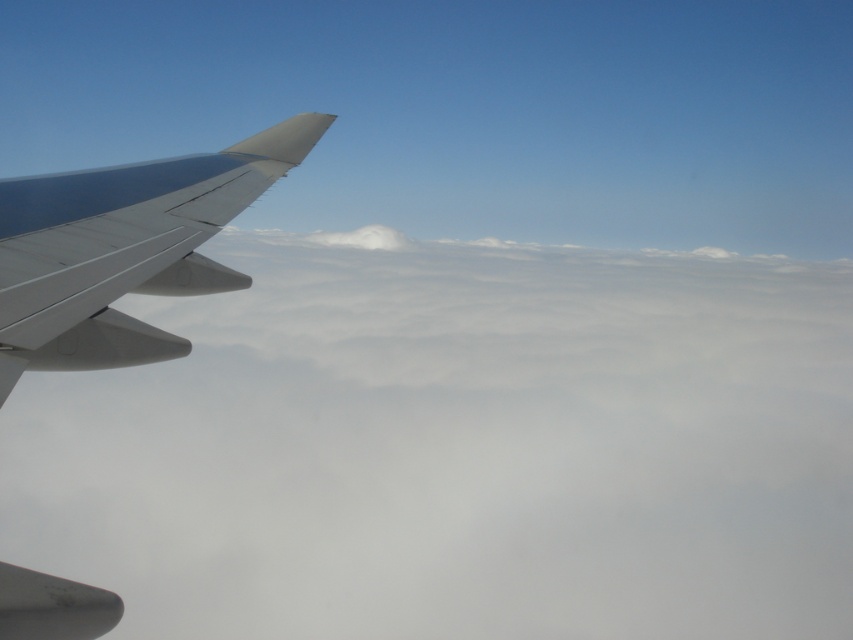
Is point (309, 305) positioned before point (39, 228)?

No, it is not.

Between white fluffy cloud at left and metallic gray wing at left, which one is positioned lower?

white fluffy cloud at left is below.

The image size is (853, 640). In order to click on white fluffy cloud at left in this screenshot , I will do click(x=457, y=445).